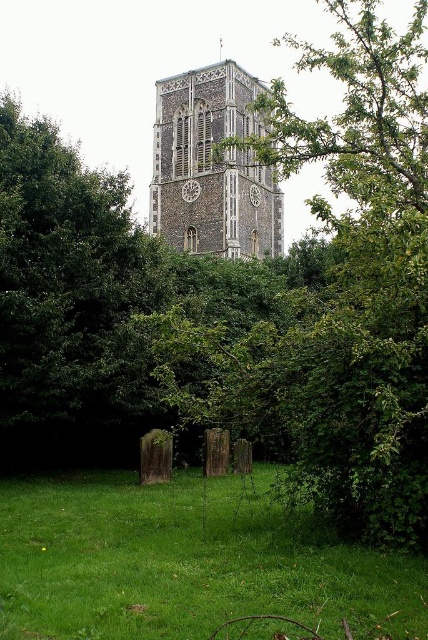
You are a gardener who needs to trim plants in the area. You see the green leafy tree at center and the green grass at lower center. Which plant should you prioritize trimming first based on their height?

The green leafy tree at center is taller than the green grass at lower center, so you should prioritize trimming the green leafy tree at center first.

You are a gardener tasked with mowing the green grass at lower center near the stone clock tower at center. Based on the scene description, where exactly should you position the lawnmower to start cutting the grass?

The green grass at lower center is located below the stone clock tower at center, so you should position the lawnmower at the base of the stone clock tower at center where the grass is growing.